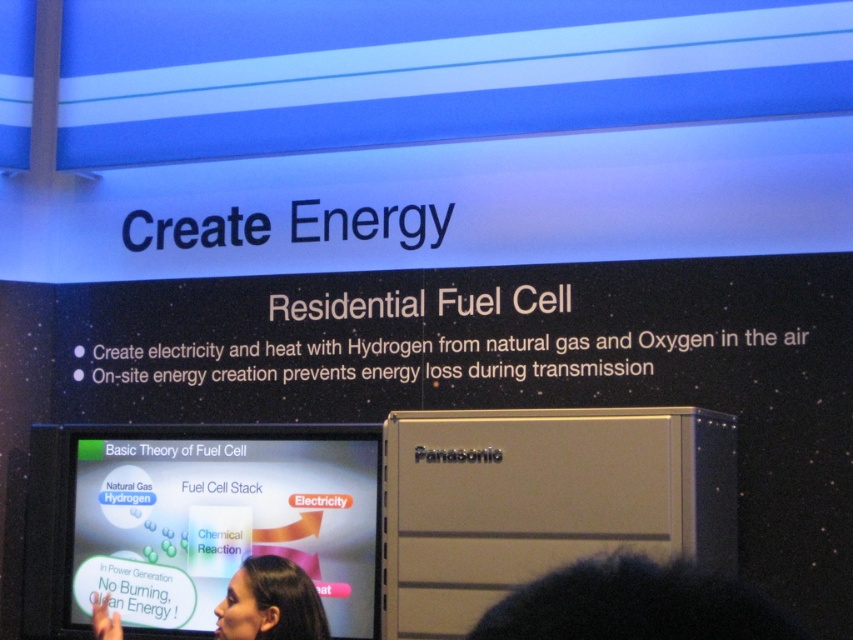
Consider the image. You are a photographer at the event and need to capture a photo that includes both the matte white screen at center and the smooth skin face at lower center. Considering their sizes, which object should you focus on first to ensure both are in frame?

The matte white screen at center is larger in size than the smooth skin face at lower center, so you should focus on framing the matte white screen at center first to ensure both objects fit within the photo.

You are an attendee at the trade show and you want to take a photo of the presentation screen. However, there is a person blocking your view. Which object is closer to you between the matte white screen at center and the smooth skin face at lower center?

The smooth skin face at lower center is closer to you than the matte white screen at center, so the person is blocking your view of the screen.

You are standing at the entrance of the exhibition hall and want to take a photo of the matte white screen at center. Based on its position coordinates, where should you position yourself to ensure it is centered in your camera view?

The matte white screen at center is located at coordinates point (221, 520), so you should position yourself directly facing that coordinate point to center it in your camera view.